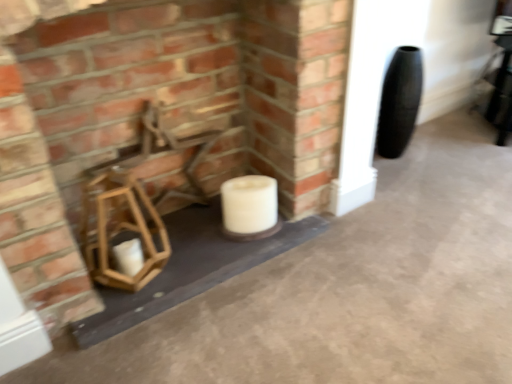
Where is `vacant point above white matte candle at center (from a real-world perspective)`? The width and height of the screenshot is (512, 384). vacant point above white matte candle at center (from a real-world perspective) is located at coordinates (250, 185).